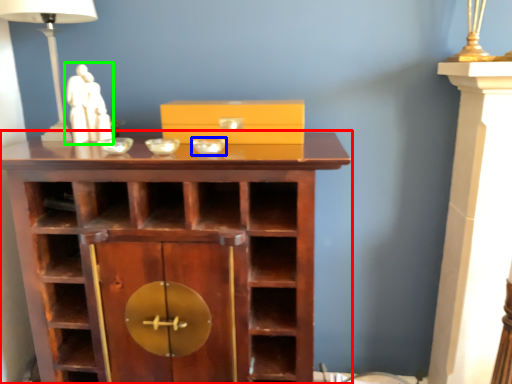
Question: Based on their relative distances, which object is nearer to shelf (highlighted by a red box)? Choose from glass bowl (highlighted by a blue box) and sculpture (highlighted by a green box).

Choices:
 (A) glass bowl
 (B) sculpture

Answer: (A)